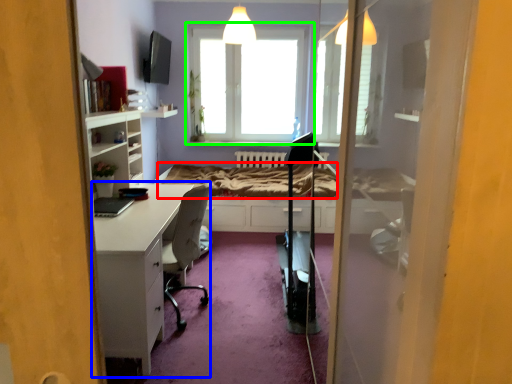
Question: Which object is positioned farthest from bed frame (highlighted by a red box)? Select from desk (highlighted by a blue box) and window (highlighted by a green box).

Choices:
 (A) desk
 (B) window

Answer: (A)